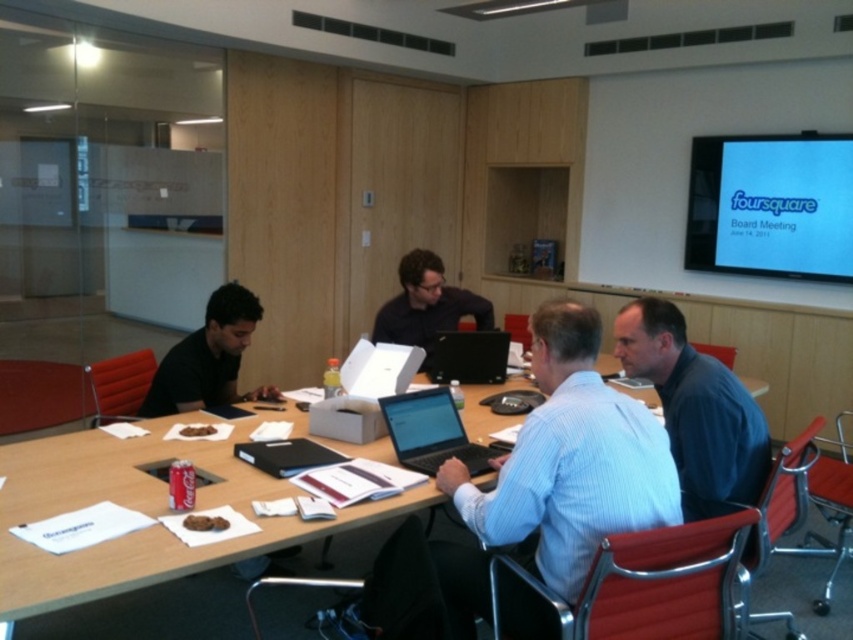
You are sitting at the conference table and want to reach both the point at coordinates point (691,435) and point (498,452). Which point is closer to you?

Point (691,435) is in front of point (498,452), so it is closer to you.

You are a participant in the meeting and need to access your laptop. Which laptop is closer to you, the matte black laptop at center or the black matte laptop at center?

Both the matte black laptop at center and the black matte laptop at center are the same object. Therefore, there is no difference in their distance from you.

You are a photographer taking a picture of the dark blue shirt at center and the silver metallic laptop at center. Which object should you focus on first to ensure both are in sharp focus?

You should focus on the dark blue shirt at center first because it is closer to the viewer than the silver metallic laptop at center, so adjusting focus from near to far will help both be in sharp focus.